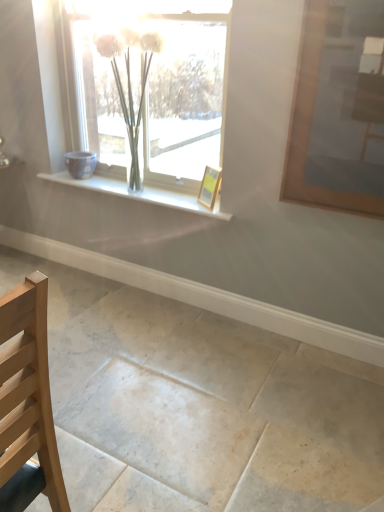
At what (x,y) coordinates should I click in order to perform the action: click on empty space that is ontop of white glossy window sill at center (from a real-world perspective). Please return your answer as a coordinate pair (x, y). The width and height of the screenshot is (384, 512). Looking at the image, I should click on (123, 183).